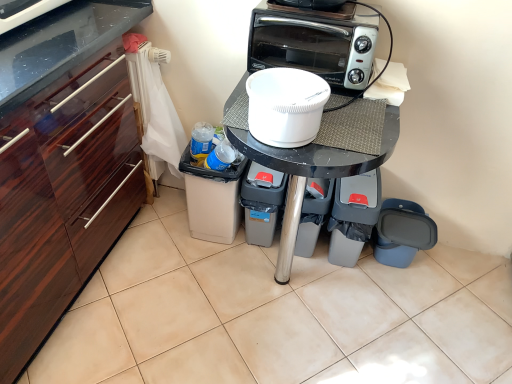
The image size is (512, 384). What are the coordinates of `free point in front of gray plastic trash can at lower right, which ranks as the 3th appliance in left-to-right order` in the screenshot? It's located at (349, 289).